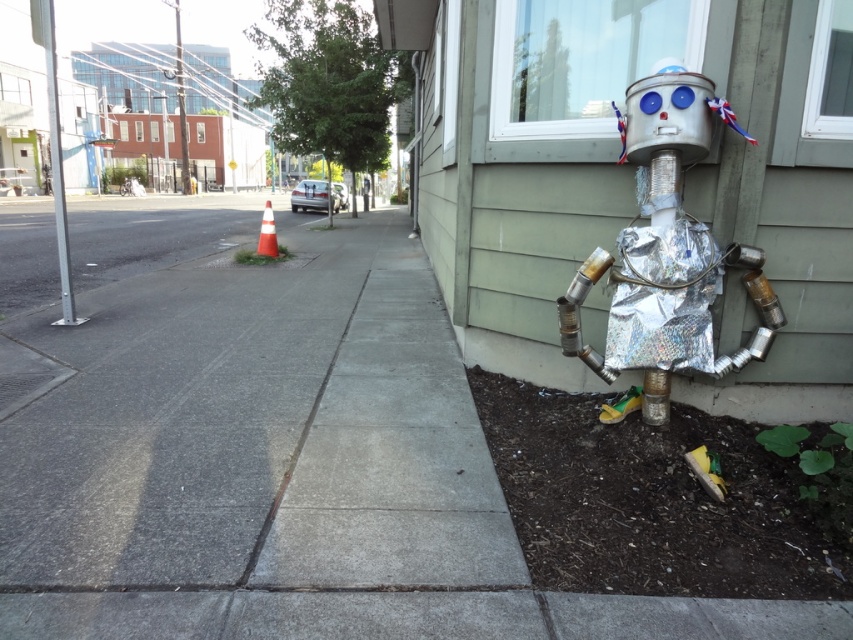
Does gray concrete sidewalk at center have a greater height compared to holographic foil robot at lower right?

Yes.

Can you confirm if gray concrete sidewalk at center is positioned above holographic foil robot at lower right?

Indeed, gray concrete sidewalk at center is positioned over holographic foil robot at lower right.

Between point (445, 518) and point (670, 141), which one is positioned behind?

Point (670, 141)

At what (x,y) coordinates should I click in order to perform the action: click on gray concrete sidewalk at center. Please return your answer as a coordinate pair (x, y). This screenshot has width=853, height=640. Looking at the image, I should click on (277, 456).

Does point (714, 588) lie behind point (654, 285)?

That is False.

Can you confirm if dark brown soil at lower right is thinner than holographic foil robot at lower right?

No.

Is point (758, 476) behind point (619, 404)?

No, it is not.

The width and height of the screenshot is (853, 640). In order to click on dark brown soil at lower right in this screenshot , I will do `click(651, 500)`.

Does gray concrete sidewalk at center have a larger size compared to dark brown soil at lower right?

Yes.

Which of these two, gray concrete sidewalk at center or dark brown soil at lower right, stands taller?

Standing taller between the two is gray concrete sidewalk at center.

Between point (409, 496) and point (810, 442), which one is positioned behind?

Positioned behind is point (810, 442).

Find the location of a particular element. gray concrete sidewalk at center is located at coordinates (277, 456).